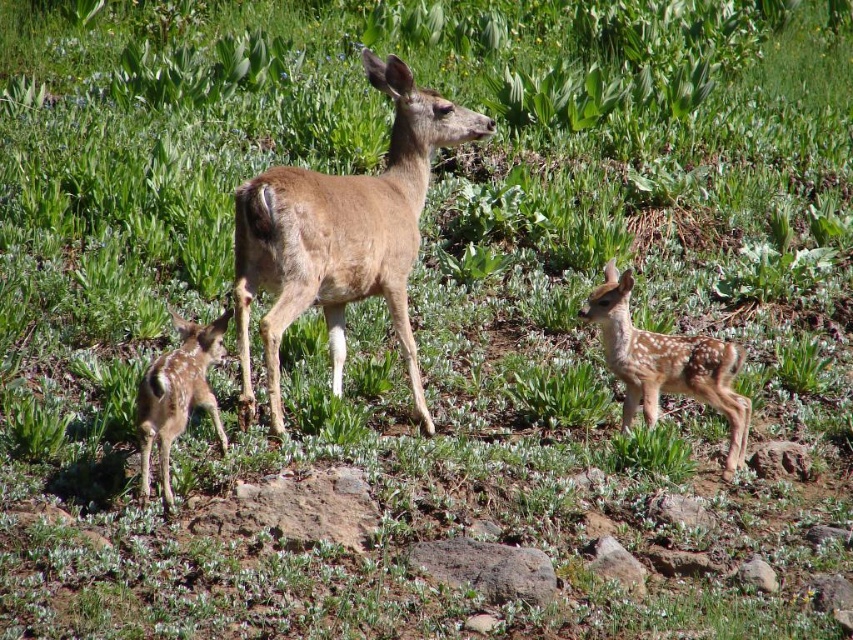
Can you confirm if brown matte deer at center is wider than fawn fur fawn at lower left?

Indeed, brown matte deer at center has a greater width compared to fawn fur fawn at lower left.

Who is positioned more to the left, brown matte deer at center or fawn fur fawn at lower left?

Positioned to the left is fawn fur fawn at lower left.

Locate an element on the screen. brown matte deer at center is located at coordinates (341, 236).

In the scene shown: Is fawn fur fawn at center wider than fawn fur fawn at lower left?

Indeed, fawn fur fawn at center has a greater width compared to fawn fur fawn at lower left.

Is point (703, 339) farther from camera compared to point (152, 396)?

Yes, point (703, 339) is behind point (152, 396).

Where is `fawn fur fawn at center`? This screenshot has height=640, width=853. fawn fur fawn at center is located at coordinates (666, 364).

From the picture: Is brown matte deer at center positioned at the back of fawn fur fawn at center?

No, brown matte deer at center is closer to the viewer.

Is brown matte deer at center thinner than fawn fur fawn at center?

No.

This screenshot has height=640, width=853. Find the location of `brown matte deer at center`. brown matte deer at center is located at coordinates (341, 236).